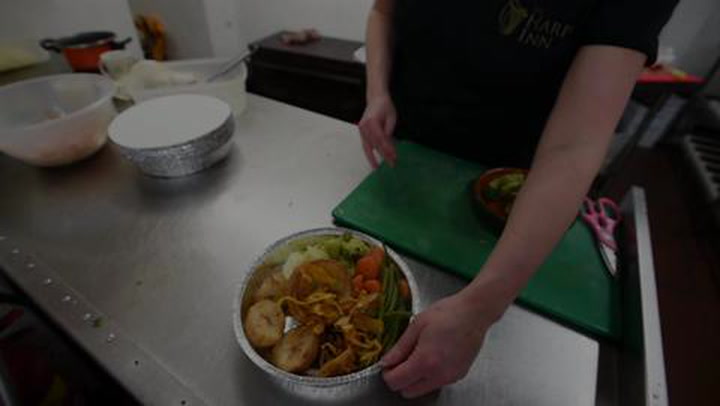
The height and width of the screenshot is (406, 720). I want to click on red pot for cooking, so click(78, 59).